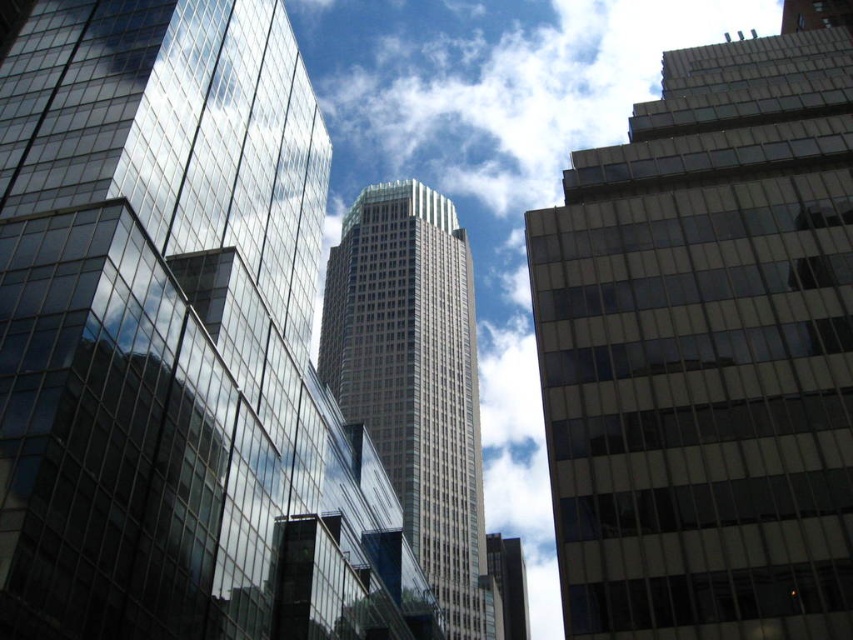
Does glassy reflective skyscraper at center appear over beige glass skyscraper at center?

No.

Does glassy reflective skyscraper at center appear on the right side of beige glass skyscraper at center?

Incorrect, glassy reflective skyscraper at center is not on the right side of beige glass skyscraper at center.

Between point (343, 512) and point (444, 500), which one is positioned in front?

Point (343, 512)

Find the location of a particular element. The width and height of the screenshot is (853, 640). glassy reflective skyscraper at center is located at coordinates (177, 342).

Which is in front, point (444, 481) or point (496, 552)?

Point (444, 481) is more forward.

Where is `beige glass skyscraper at center`? The image size is (853, 640). beige glass skyscraper at center is located at coordinates pyautogui.click(x=415, y=381).

Can you confirm if matte glass building at right is bigger than smooth glass skyscraper at center?

No.

Can you confirm if matte glass building at right is positioned to the right of smooth glass skyscraper at center?

Incorrect, matte glass building at right is not on the right side of smooth glass skyscraper at center.

Which is in front, point (734, 76) or point (488, 550)?

Point (734, 76) is more forward.

Identify the location of matte glass building at right. (705, 353).